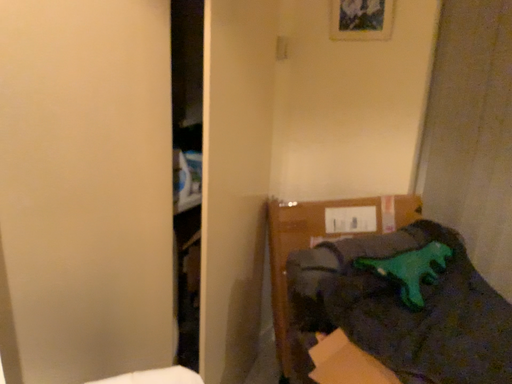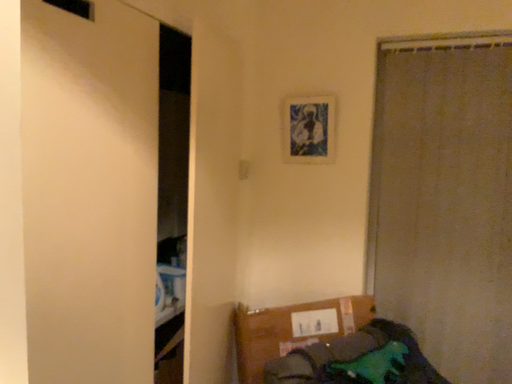
Question: How did the camera likely rotate when shooting the video?

Choices:
 (A) rotated right
 (B) rotated left

Answer: (A)